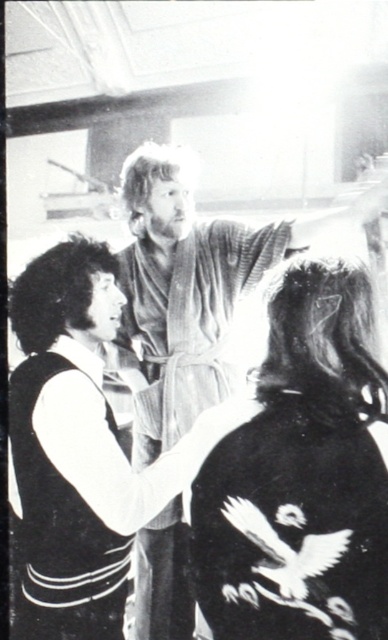
You are a photographer adjusting your camera settings in this dimly lit room. You want to focus on the textured cotton robe at center and the curly hair at center. Which object should you adjust your focus on first if you want to capture the one that is closer to you?

The textured cotton robe at center is closer to the viewer than curly hair at center, so you should focus on the textured cotton robe at center first.

Consider the image. You are an observer in the scene described. You notice the textured cotton robe at center and the curly hair at left. Which object is located to the right of the other?

The textured cotton robe at center is positioned on the right side of curly hair at left.

You are a photographer setting up equipment in the scene. You need to place a 20 inch tripod between the textured cotton robe at center and the curly hair at left. Will there be enough space?

The distance between the textured cotton robe at center and the curly hair at left is 22.01 inches. Since the tripod requires 20 inches, there will be enough space to place it between them.